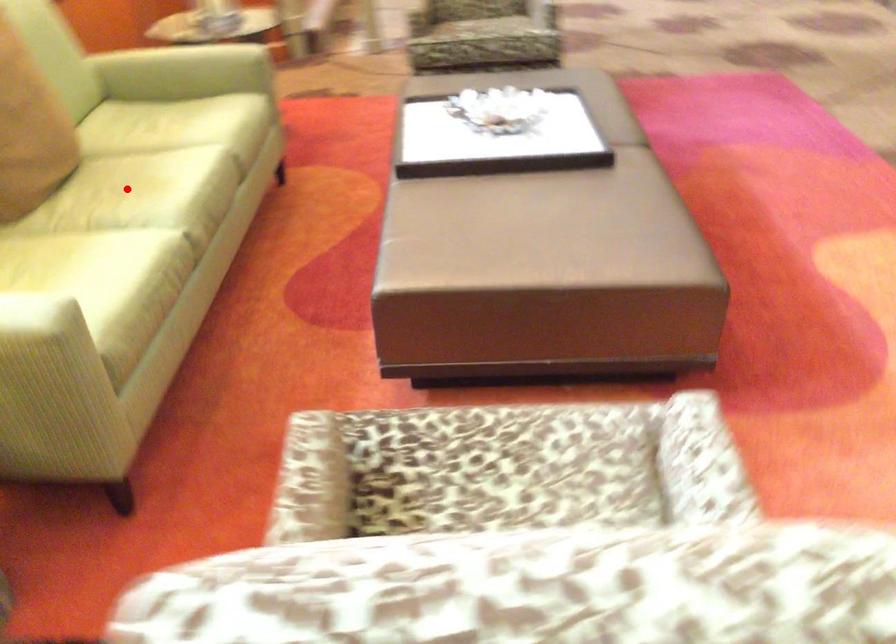
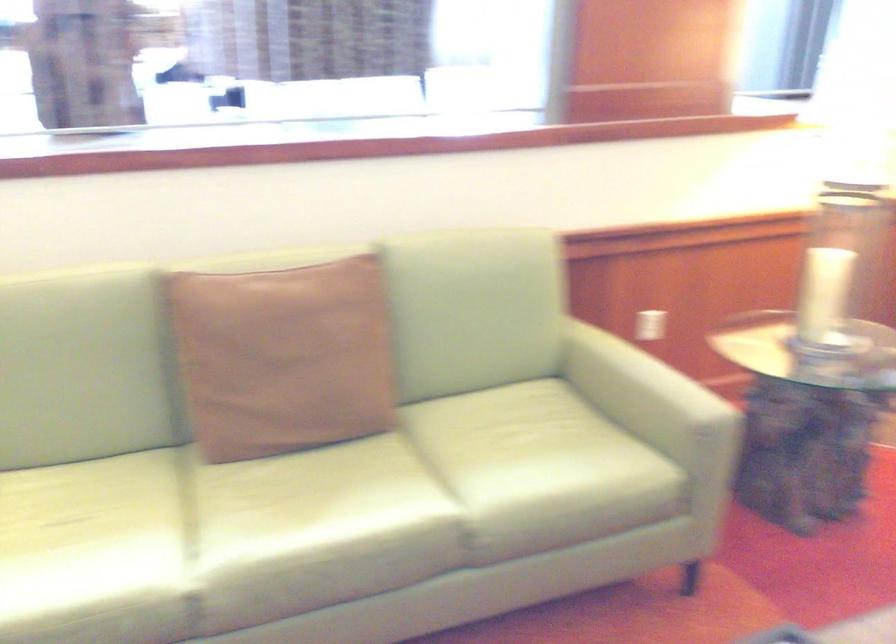
Question: A red point is marked in image1. In image2, is the corresponding 3D point closer to the camera or farther? Reply with the corresponding letter.

Choices:
 (A) The corresponding 3D point is closer.
 (B) The corresponding 3D point is farther.

Answer: (A)